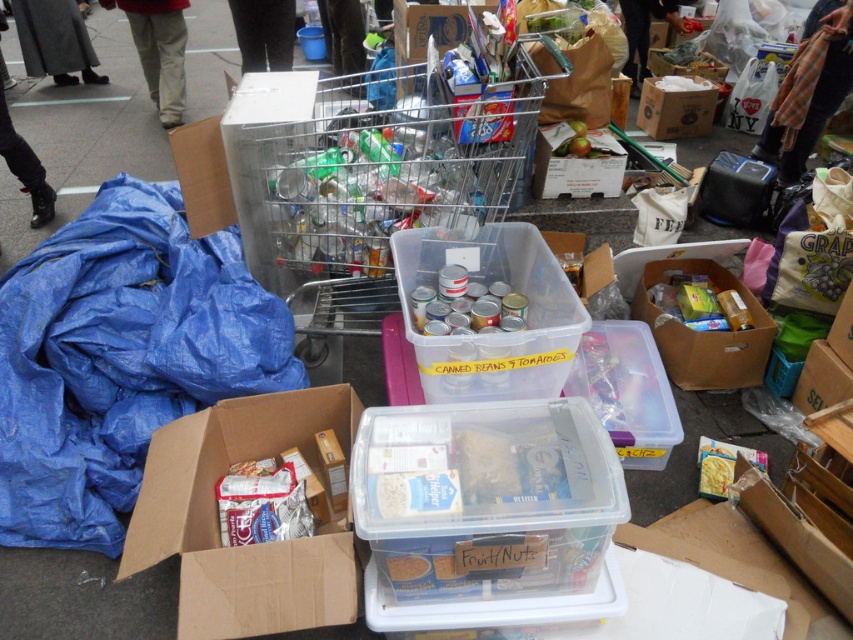
Can you confirm if brown cardboard box at lower left is positioned to the right of brown cardboard box at center?

Incorrect, brown cardboard box at lower left is not on the right side of brown cardboard box at center.

The width and height of the screenshot is (853, 640). Describe the element at coordinates (253, 545) in the screenshot. I see `brown cardboard box at lower left` at that location.

At what (x,y) coordinates should I click in order to perform the action: click on brown cardboard box at lower left. Please return your answer as a coordinate pair (x, y). Looking at the image, I should click on (253, 545).

How far apart are clear wire shopping cart at center and transparent plastic container at center?

The distance of clear wire shopping cart at center from transparent plastic container at center is 17.93 inches.

Is clear wire shopping cart at center to the right of transparent plastic container at center from the viewer's perspective?

Incorrect, clear wire shopping cart at center is not on the right side of transparent plastic container at center.

Is point (318, 314) behind point (512, 232)?

That is True.

You are a GUI agent. You are given a task and a screenshot of the screen. Output one action in this format:
    pyautogui.click(x=<x>, y=<y>)
    Task: Click on the clear wire shopping cart at center
    
    Given the screenshot: What is the action you would take?
    pyautogui.click(x=364, y=179)

In the scene shown: Is blue plastic bag at left shorter than transparent plastic container at center?

No.

Is point (36, 314) positioned in front of point (526, 387)?

No, it is behind (526, 387).

Is point (137, 403) more distant than point (474, 372)?

That is True.

At what (x,y) coordinates should I click in order to perform the action: click on blue plastic bag at left. Please return your answer as a coordinate pair (x, y). Image resolution: width=853 pixels, height=640 pixels. Looking at the image, I should click on (120, 356).